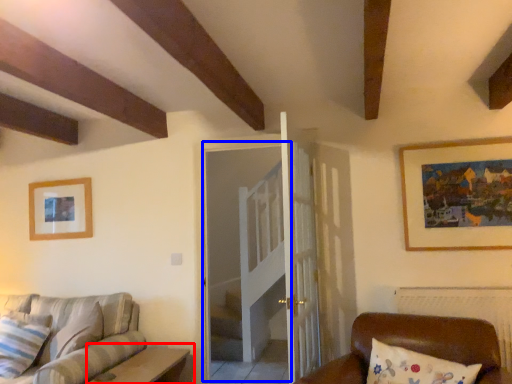
Question: Which object is closer to the camera taking this photo, table (highlighted by a red box) or glass door (highlighted by a blue box)?

Choices:
 (A) table
 (B) glass door

Answer: (A)